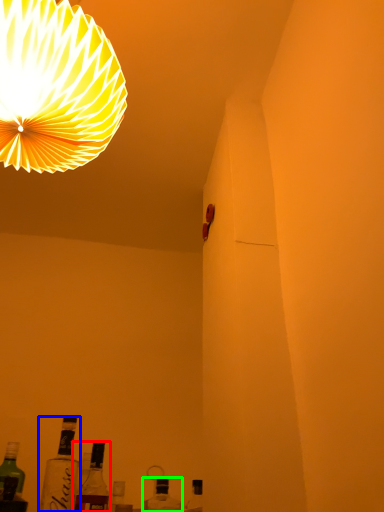
Question: Which object is positioned farthest from bottle (highlighted by a red box)? Select from bottle (highlighted by a blue box) and bottle (highlighted by a green box).

Choices:
 (A) bottle
 (B) bottle

Answer: (B)